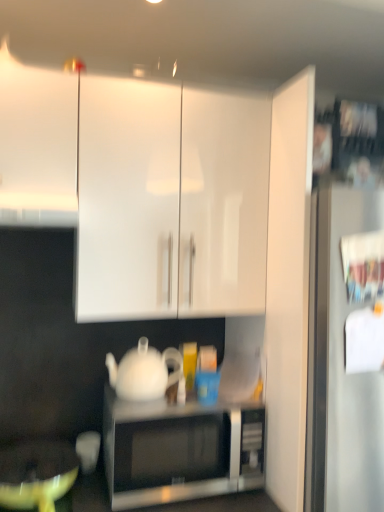
Question: From a real-world perspective, is white glossy cabinet at upper center, the second cabinetry from the left, positioned above or below white glossy cabinet at upper left, the 1th cabinetry viewed from the left?

Choices:
 (A) above
 (B) below

Answer: (B)

Question: Considering the positions of white glossy cabinet at upper center, the second cabinetry from the left, and white glossy cabinet at upper left, the 1th cabinetry viewed from the left, in the image, is white glossy cabinet at upper center, the second cabinetry from the left, taller or shorter than white glossy cabinet at upper left, the 1th cabinetry viewed from the left,?

Choices:
 (A) tall
 (B) short

Answer: (A)

Question: Which object is the farthest from the matte yellow mixing bowl at lower left?

Choices:
 (A) sleek silver microwave at center
 (B) white glossy cabinet at upper center, the second cabinetry from the left
 (C) white glossy cabinet at upper left, which ranks as the 2th cabinetry in right-to-left order
 (D) white glossy teapot at center

Answer: (C)

Question: Which is nearer to the matte yellow mixing bowl at lower left?

Choices:
 (A) white glossy teapot at center
 (B) sleek silver microwave at center
 (C) white glossy cabinet at upper center, the second cabinetry from the left
 (D) white glossy cabinet at upper left, which ranks as the 2th cabinetry in right-to-left order

Answer: (B)